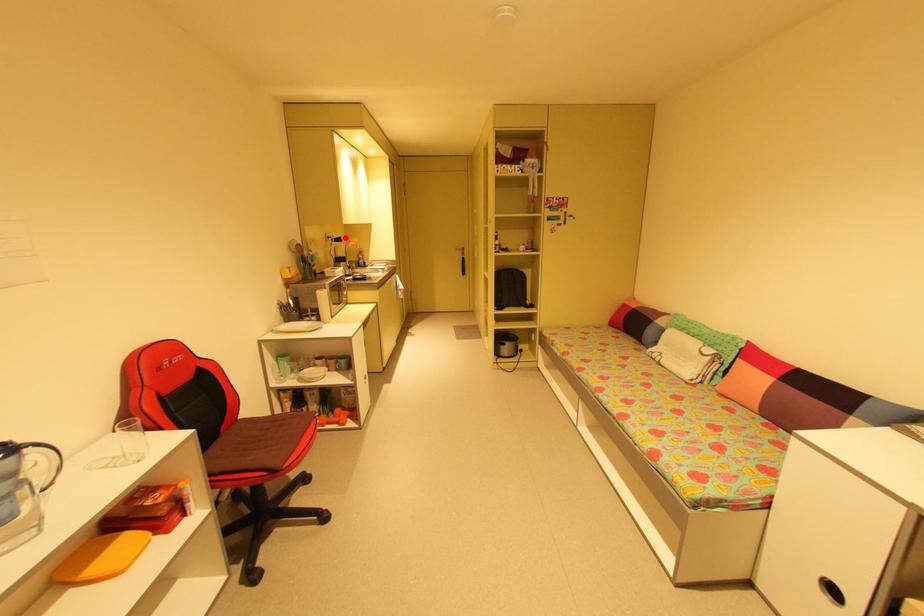
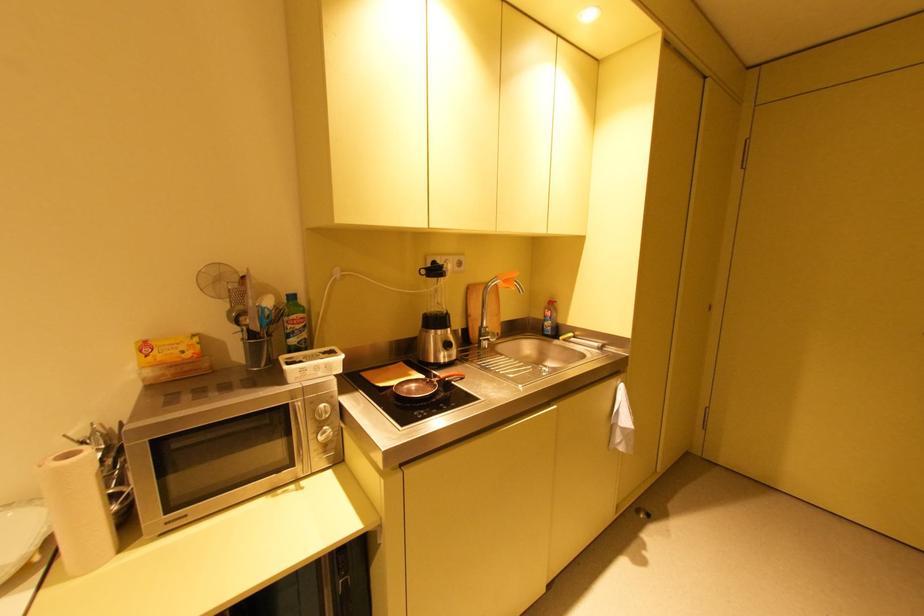
Question: I am providing you with two images of the same scene from different viewpoints. A red point is shown in image1. For the corresponding object point in image2, is it positioned nearer or farther from the camera?

Choices:
 (A) Nearer
 (B) Farther

Answer: (B)